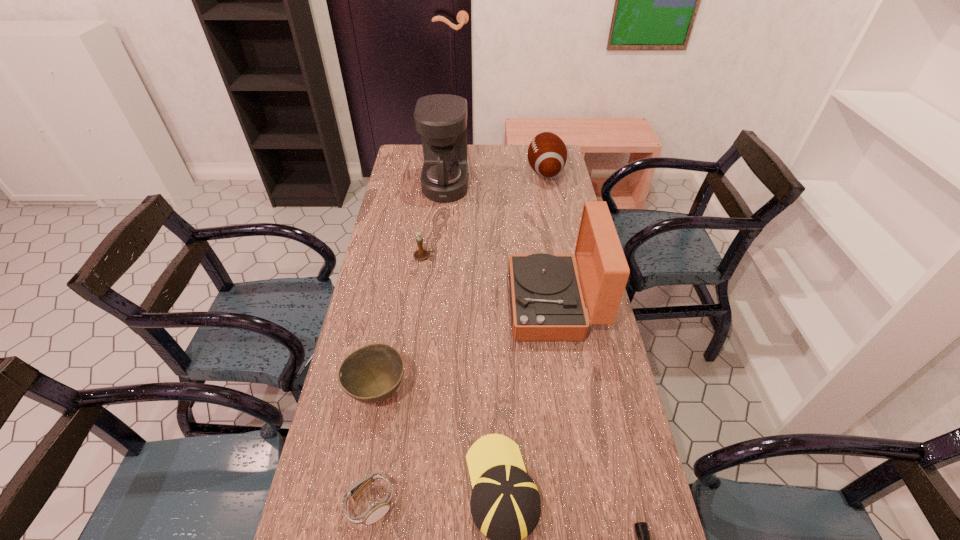
Where is `vacant position located on the face of the second tallest object`? The width and height of the screenshot is (960, 540). vacant position located on the face of the second tallest object is located at coordinates [403, 303].

Image resolution: width=960 pixels, height=540 pixels. What are the coordinates of `vacant space located on the laces of the football` in the screenshot? It's located at (460, 172).

The image size is (960, 540). I want to click on free spot located on the laces of the football, so click(x=443, y=172).

This screenshot has width=960, height=540. Identify the location of blank space located 0.190m on the laces of the football. (485, 172).

Where is `free region located on the side of the candle holder with the handle`? This screenshot has width=960, height=540. free region located on the side of the candle holder with the handle is located at coordinates (544, 256).

This screenshot has height=540, width=960. I want to click on vacant region located 0.080m on the right of the fourth nearest object, so [438, 392].

At what (x,y) coordinates should I click in order to perform the action: click on vacant space located on the face of the seventh tallest object. Please return your answer as a coordinate pair (x, y). The image size is (960, 540). Looking at the image, I should click on (433, 504).

Locate an element on the screen. This screenshot has height=540, width=960. coffee maker that is positioned at the far edge is located at coordinates (441, 119).

Identify the location of football present at the far edge. (547, 154).

At what (x,y) coordinates should I click in order to perform the action: click on coffee maker located at the left edge. Please return your answer as a coordinate pair (x, y). Looking at the image, I should click on (441, 119).